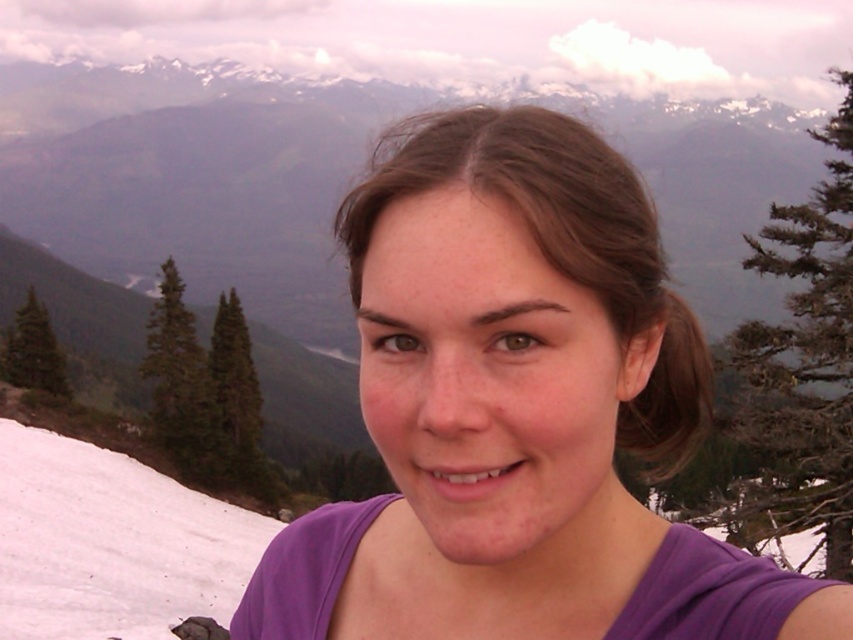
Question: From the image, what is the correct spatial relationship of green textured pine tree at left in relation to green matte pine at left?

Choices:
 (A) above
 (B) below

Answer: (B)

Question: Which object is the farthest from the green matte pine at left?

Choices:
 (A) white snow at lower left
 (B) green textured pine tree at left
 (C) purple fabric at center

Answer: (C)

Question: Which object is positioned farthest from the purple fabric at center?

Choices:
 (A) green matte pine at center
 (B) green textured pine tree at left

Answer: (A)

Question: Which object appears farthest from the camera in this image?

Choices:
 (A) green textured pine tree at left
 (B) green matte pine at left
 (C) white snow at lower left

Answer: (B)

Question: Can you confirm if green textured pine tree at left is bigger than green matte pine at center?

Choices:
 (A) yes
 (B) no

Answer: (A)

Question: Is purple fabric at center in front of green textured pine tree at left?

Choices:
 (A) no
 (B) yes

Answer: (B)